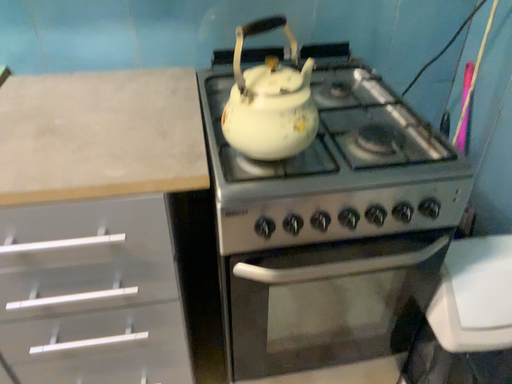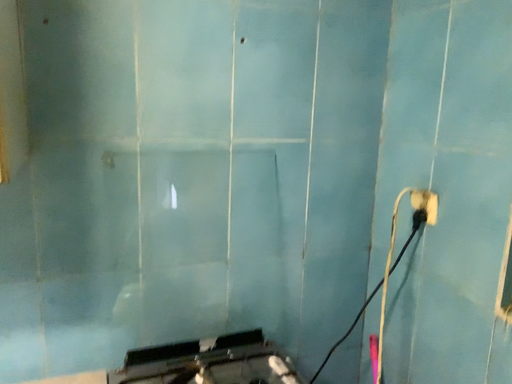
Question: Which way did the camera rotate in the video?

Choices:
 (A) rotated upward
 (B) rotated downward

Answer: (A)